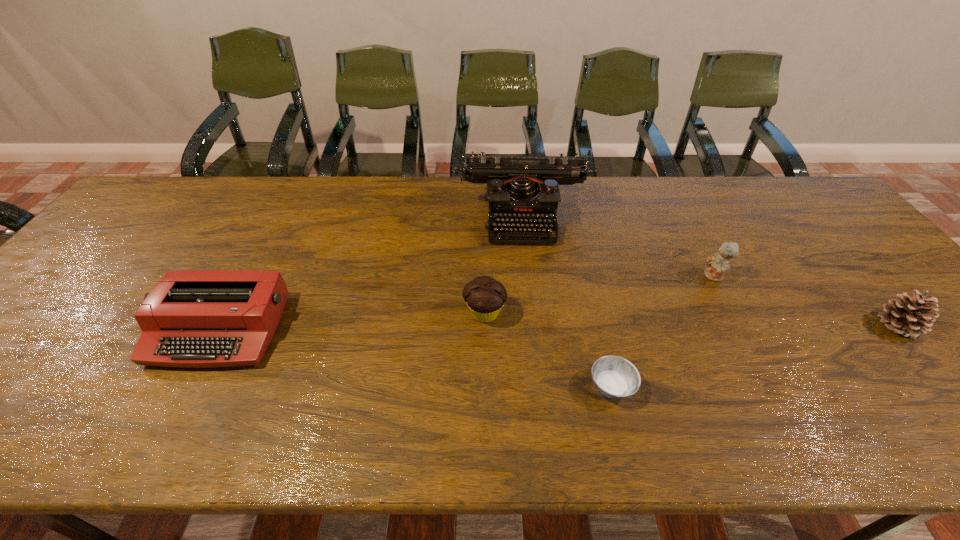
The height and width of the screenshot is (540, 960). What are the coordinates of `vacant region that satisfies the following two spatial constraints: 1. on the keyboard of the pinecone; 2. on the left side of the taller typewriter` in the screenshot? It's located at (x=537, y=326).

Identify the location of free space that satisfies the following two spatial constraints: 1. on the front-facing side of the teddy bear; 2. on the typing side of the shorter typewriter. (742, 330).